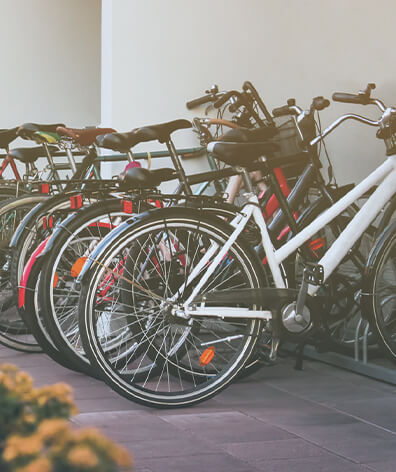
Locate an element on the screen. The width and height of the screenshot is (396, 472). handles is located at coordinates (346, 98), (318, 101), (283, 107), (217, 101), (232, 106), (244, 83), (197, 95), (214, 121).